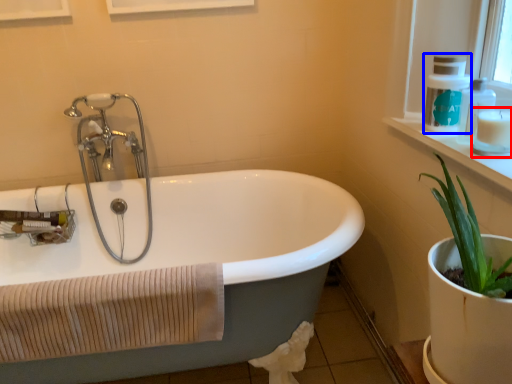
Question: Which object appears farthest to the camera in this image, toiletry (highlighted by a red box) or soap dispenser (highlighted by a blue box)?

Choices:
 (A) toiletry
 (B) soap dispenser

Answer: (B)